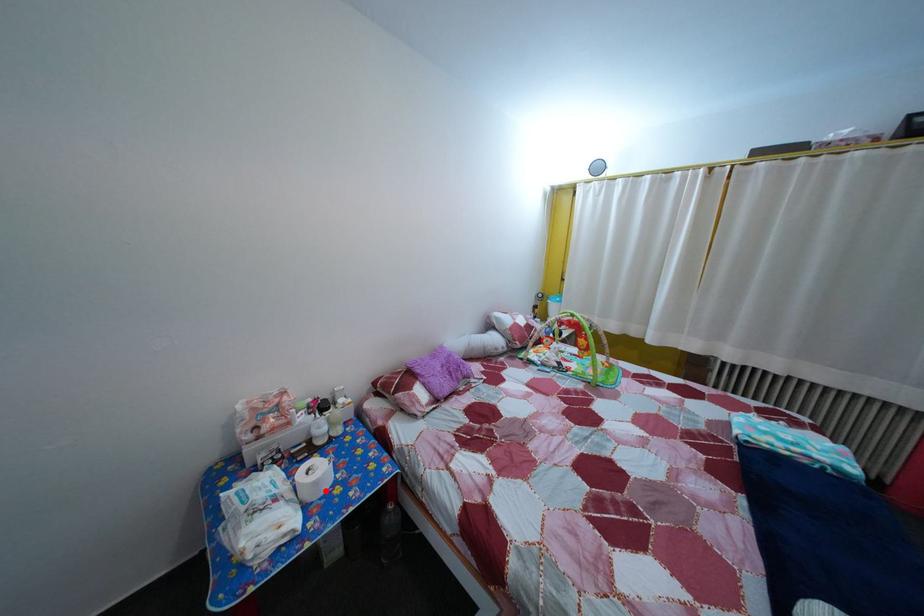
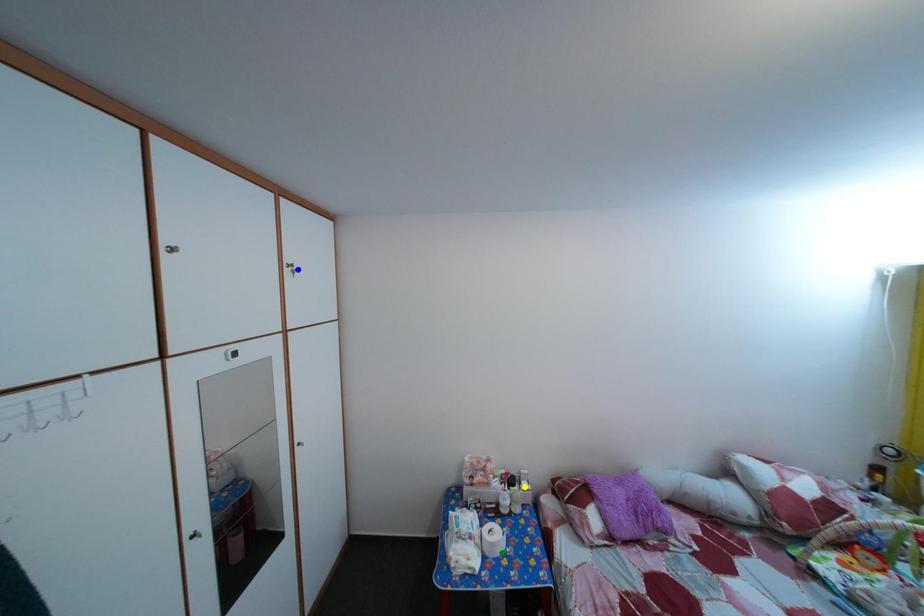
Question: I am providing you with two images of the same scene from different viewpoints. A red point is marked on the first image. You are given multiple points on the second image. Which point in image 2 represents the same 3d spot as the red point in image 1?

Choices:
 (A) blue point
 (B) yellow point
 (C) green point

Answer: (C)